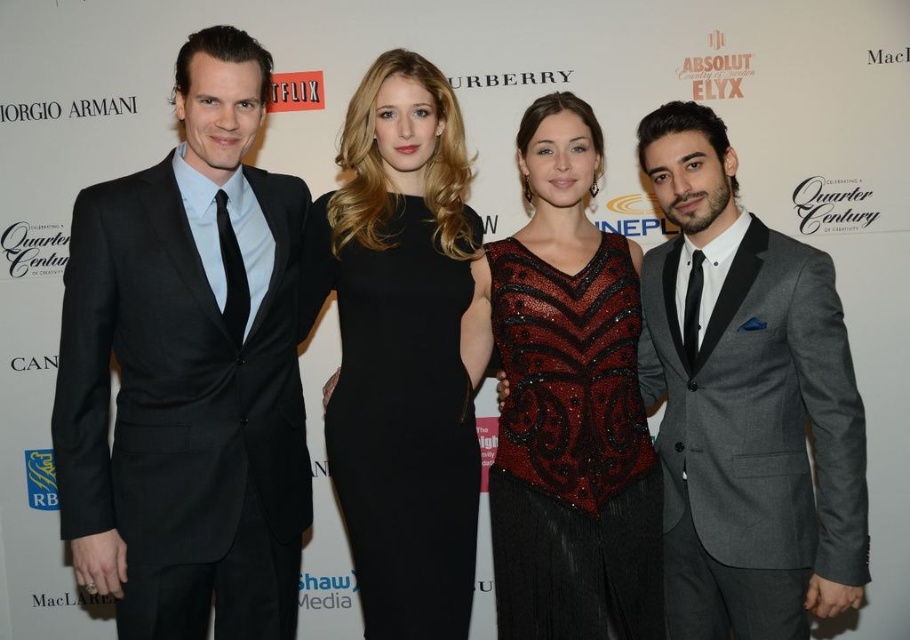
Question: Can you confirm if black satin suit at left is positioned to the right of black satin dress at center?

Choices:
 (A) yes
 (B) no

Answer: (B)

Question: Which object appears farthest from the camera in this image?

Choices:
 (A) gray wool suit at right
 (B) black satin suit at left
 (C) black satin dress at center
 (D) shiny sequined top at center

Answer: (C)

Question: Which point is farther from the camera taking this photo?

Choices:
 (A) [393, 209]
 (B) [265, 356]
 (C) [730, 332]

Answer: (A)

Question: Does gray wool suit at right have a lesser width compared to shiny sequined top at center?

Choices:
 (A) yes
 (B) no

Answer: (A)

Question: Considering the relative positions of gray wool suit at right and black satin dress at center in the image provided, where is gray wool suit at right located with respect to black satin dress at center?

Choices:
 (A) above
 (B) below

Answer: (B)

Question: Which object is the closest to the black satin dress at center?

Choices:
 (A) shiny sequined top at center
 (B) gray wool suit at right
 (C) black satin suit at left

Answer: (A)